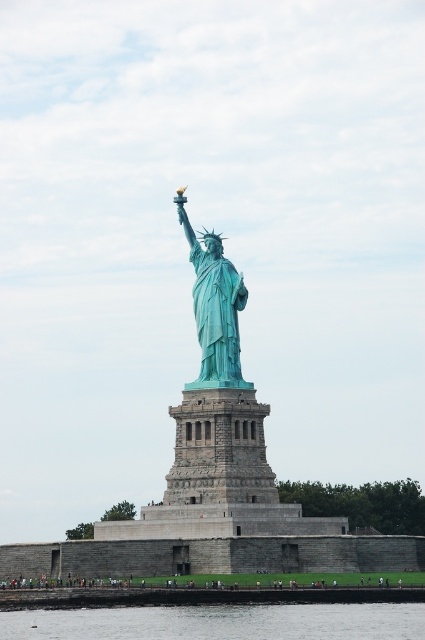
You are standing at the point marked by the coordinates (220,621) in the image of the Statue of Liberty. What is the closest object to you?

The point marked by the coordinates (220,621) corresponds to clear water at lower center, so the closest object to you is the clear water at lower center.

You are a tourist standing on the observation deck of the statue of liberty. You want to take a photo of the green patina statue at center and the clear water at lower center. Which object will appear larger in your photo?

The clear water at lower center will appear larger in the photo because it is closer to the viewer than the green patina statue at center.

You are a tourist standing on the observation deck of the pedestal of the Statue of Liberty. You see the clear water at lower center and the green patina statue at center. Which object is taller?

The green patina statue at center is taller than the clear water at lower center.